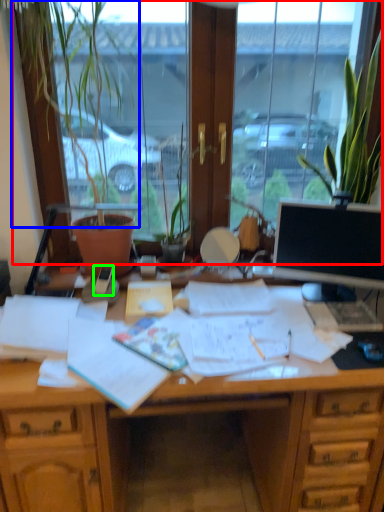
Question: Considering the real-world distances, which object is farthest from window (highlighted by a red box)? plant (highlighted by a blue box) or mobile phone (highlighted by a green box)?

Choices:
 (A) plant
 (B) mobile phone

Answer: (B)